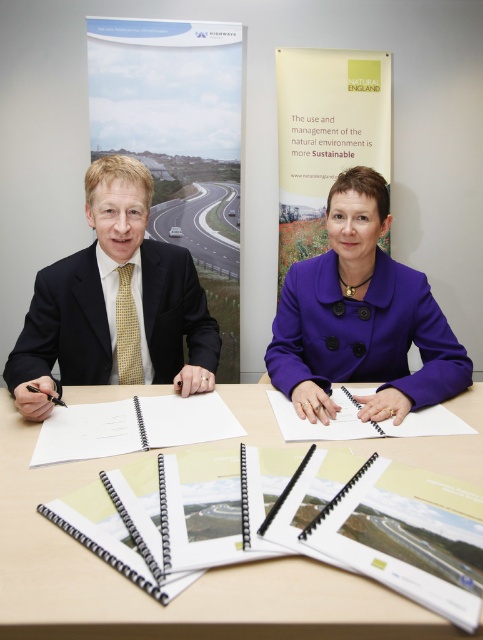
Question: Considering the real-world distances, which object is closest to the purple woolen coat at center?

Choices:
 (A) matte black suit at left
 (B) matte yellow tie at left

Answer: (A)

Question: Does matte black suit at left have a lesser width compared to matte yellow tie at left?

Choices:
 (A) no
 (B) yes

Answer: (A)

Question: Does wooden table at center appear over matte black suit at left?

Choices:
 (A) yes
 (B) no

Answer: (B)

Question: Which point appears farthest from the camera in this image?

Choices:
 (A) (142, 355)
 (B) (365, 195)
 (C) (59, 346)

Answer: (A)

Question: Can you confirm if wooden table at center is positioned below purple woolen coat at center?

Choices:
 (A) no
 (B) yes

Answer: (B)

Question: Which of the following is the closest to the observer?

Choices:
 (A) (170, 276)
 (B) (161, 371)
 (C) (184, 592)

Answer: (C)